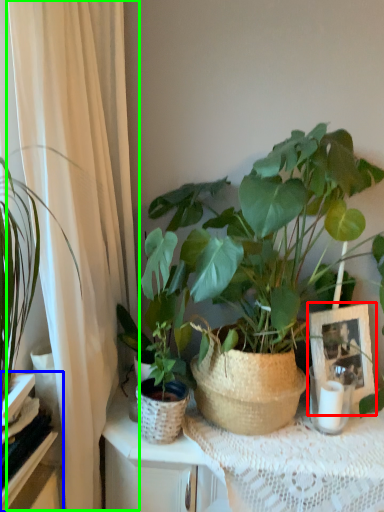
Question: Which object is positioned farthest from picture frame (highlighted by a red box)? Select from shelf (highlighted by a blue box) and curtain (highlighted by a green box).

Choices:
 (A) shelf
 (B) curtain

Answer: (A)